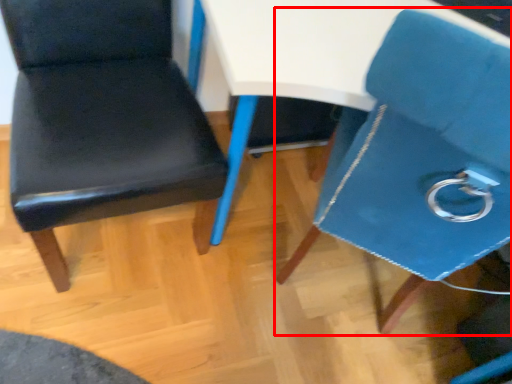
Question: Considering the relative positions of chair (annotated by the red box) and chair in the image provided, where is chair (annotated by the red box) located with respect to the staircase?

Choices:
 (A) right
 (B) left

Answer: (A)